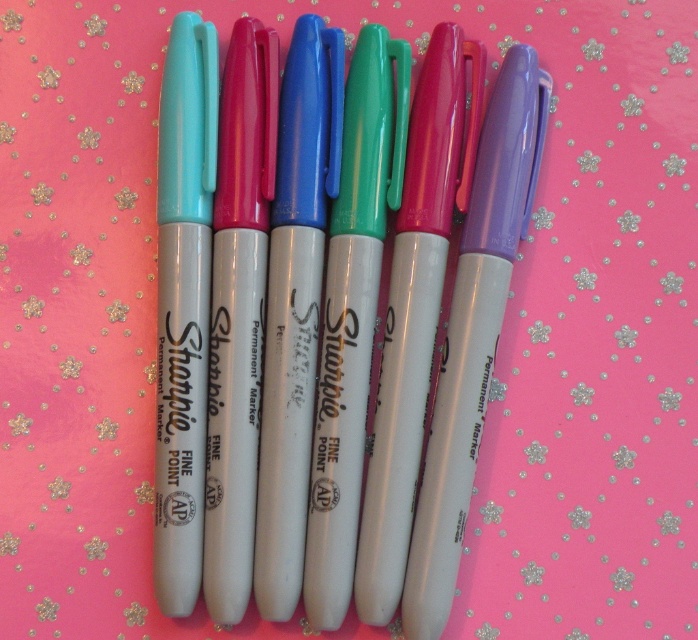
Is matte white marker at center further to the viewer compared to matte purple marker at center?

No, it is in front of matte purple marker at center.

Is matte white marker at center smaller than matte purple marker at center?

Incorrect, matte white marker at center is not smaller in size than matte purple marker at center.

Who is more forward, (311, 216) or (410, 566)?

Positioned in front is point (410, 566).

Identify the location of matte white marker at center. (364, 324).